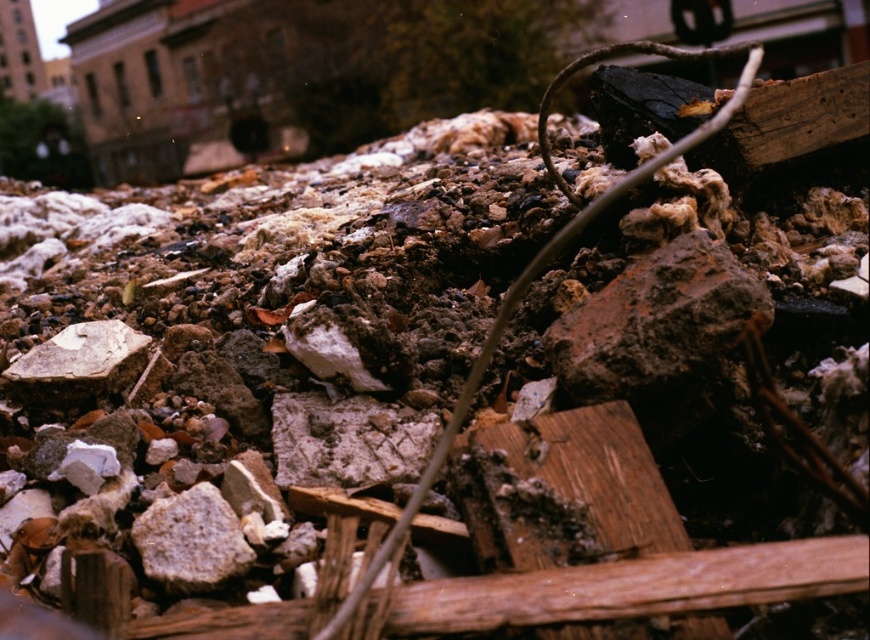
Question: Can you confirm if gray rough stone at center is smaller than white rough stone at center-left?

Choices:
 (A) no
 (B) yes

Answer: (B)

Question: Can you confirm if rusty metal rock at center is positioned to the left of white rough stone at center-left?

Choices:
 (A) yes
 (B) no

Answer: (B)

Question: Which point is closer to the camera taking this photo?

Choices:
 (A) (169, 520)
 (B) (47, 362)
 (C) (570, 394)

Answer: (A)

Question: Observing the image, what is the correct spatial positioning of rusty metal rock at center in reference to gray rough stone at center?

Choices:
 (A) left
 (B) right

Answer: (B)

Question: Which object is the closest to the rusty metal rock at center?

Choices:
 (A) gray rough stone at center
 (B) white rough stone at center-left

Answer: (A)

Question: Estimate the real-world distances between objects in this image. Which object is closer to the rusty metal rock at center?

Choices:
 (A) white rough stone at center-left
 (B) gray rough stone at center

Answer: (B)